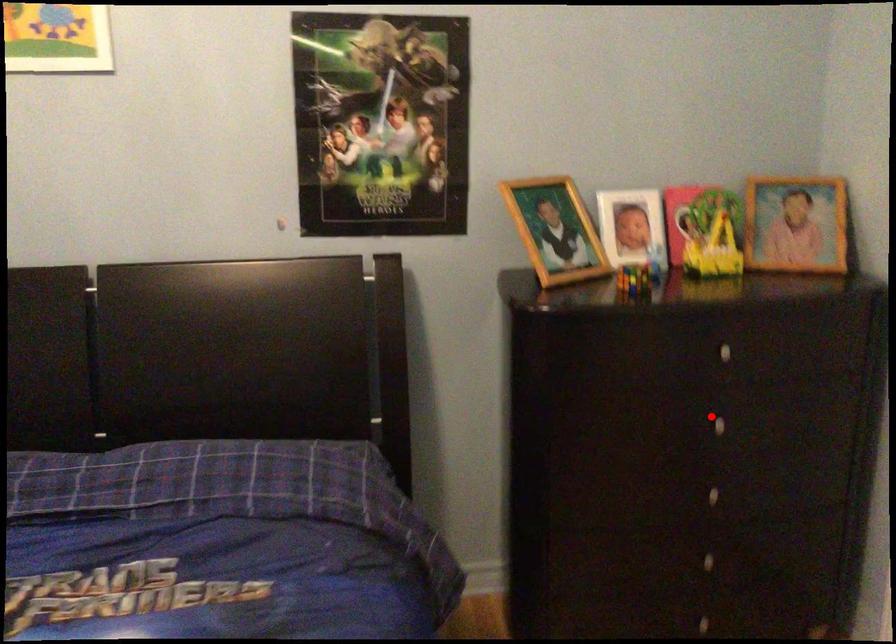
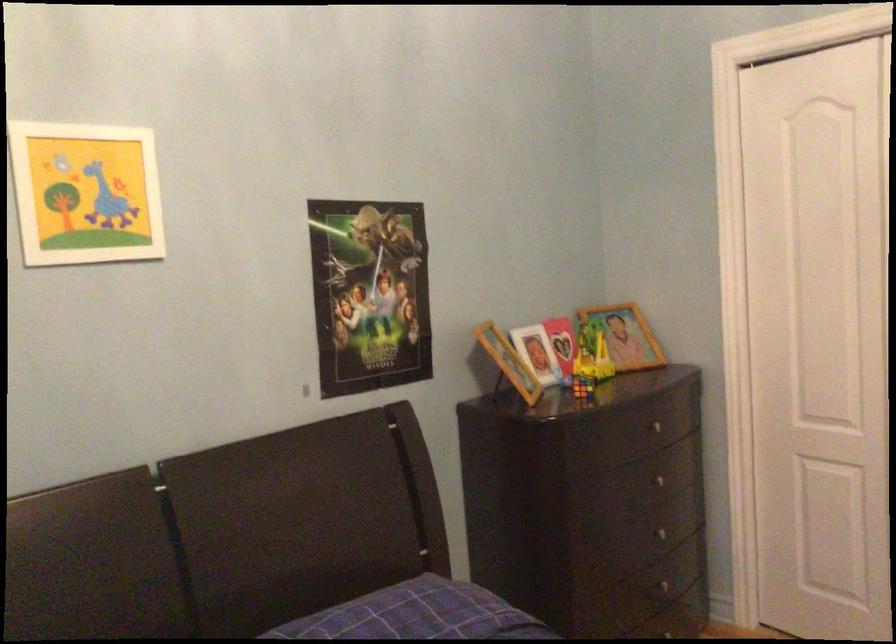
Locate, in the second image, the point that corresponds to the highlighted location in the first image.

(656, 480)